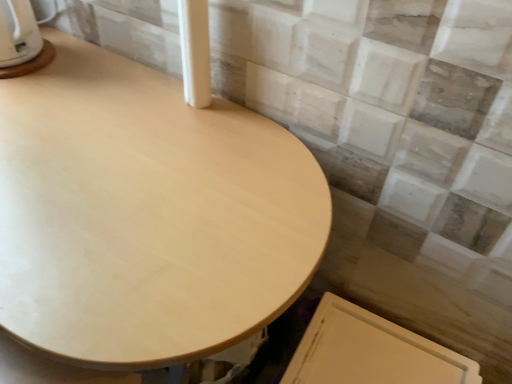
This screenshot has height=384, width=512. Find the location of `free space on the front side of white smooth pillar at upper center`. free space on the front side of white smooth pillar at upper center is located at coordinates (181, 144).